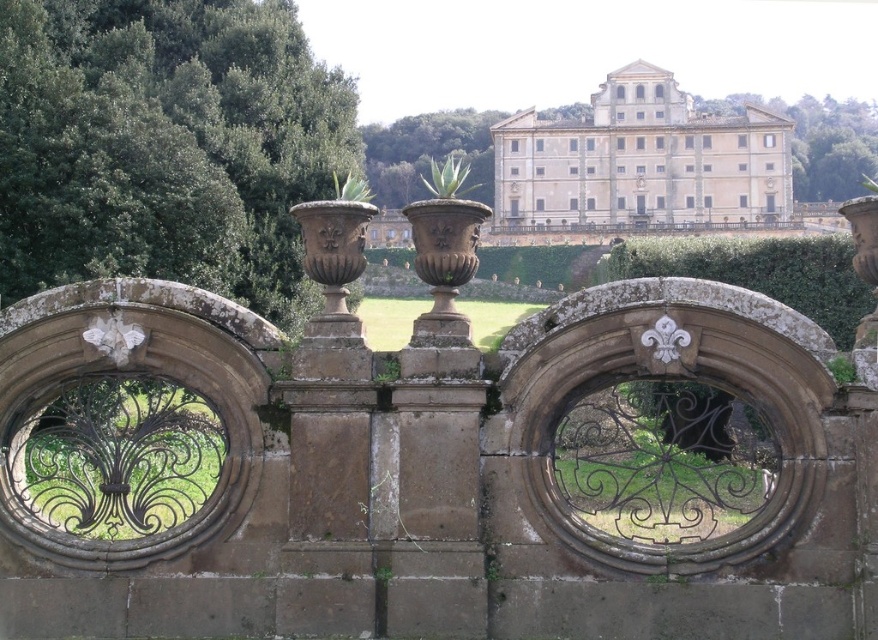
Question: Can you confirm if white stone building at center is positioned above green stone hedge at center?

Choices:
 (A) no
 (B) yes

Answer: (B)

Question: Is green stone hedge at center to the right of green leafy tree at upper center from the viewer's perspective?

Choices:
 (A) no
 (B) yes

Answer: (A)

Question: Estimate the real-world distances between objects in this image. Which object is farther from the green leafy tree at upper center?

Choices:
 (A) green stone hedge at center
 (B) green leafy tree at center
 (C) green leafy tree at upper left
 (D) white stone building at center

Answer: (C)

Question: Which object appears farthest from the camera in this image?

Choices:
 (A) green leafy tree at upper left
 (B) green leafy tree at upper center

Answer: (B)

Question: Among these points, which one is nearest to the camera?

Choices:
 (A) (483, 129)
 (B) (836, 326)

Answer: (B)

Question: Can you confirm if green leafy tree at upper left is positioned above green leafy tree at center?

Choices:
 (A) yes
 (B) no

Answer: (B)